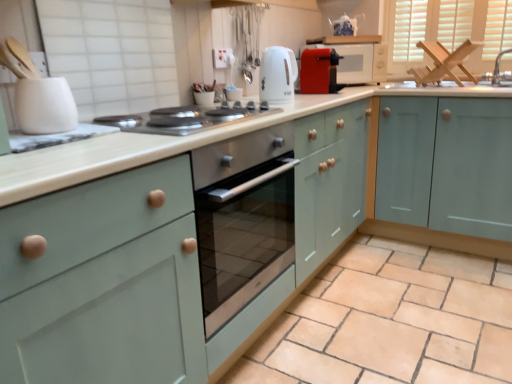
The width and height of the screenshot is (512, 384). Find the location of `free space in front of white matte cup at upper left, acting as the third kitchen appliance starting from the right`. free space in front of white matte cup at upper left, acting as the third kitchen appliance starting from the right is located at coordinates (50, 146).